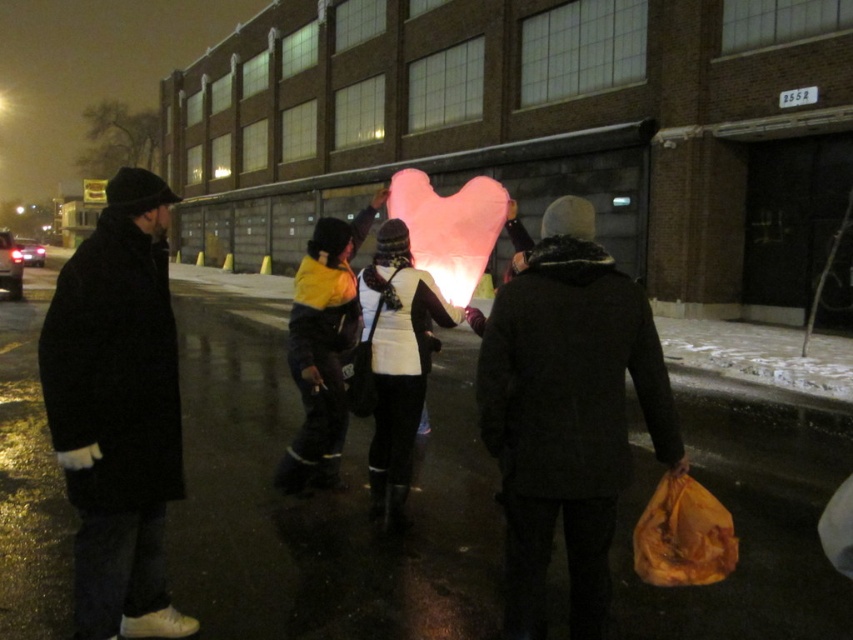
Question: Does black fuzzy coat at center appear over yellow and black jacket at center?

Choices:
 (A) yes
 (B) no

Answer: (B)

Question: Which object is closer to the camera taking this photo?

Choices:
 (A) black wool coat at left
 (B) white matte vest at center
 (C) pink fluffy heart at center

Answer: (A)

Question: Which of the following is the closest to the observer?

Choices:
 (A) (321, 486)
 (B) (419, 227)

Answer: (A)

Question: Does black fuzzy coat at center appear on the left side of pink fluffy heart at center?

Choices:
 (A) no
 (B) yes

Answer: (A)

Question: Can you confirm if black fuzzy coat at center is positioned above yellow and black jacket at center?

Choices:
 (A) yes
 (B) no

Answer: (B)

Question: Among these objects, which one is farthest from the camera?

Choices:
 (A) black wool coat at left
 (B) white matte vest at center
 (C) pink fluffy heart at center
 (D) yellow and black jacket at center

Answer: (D)